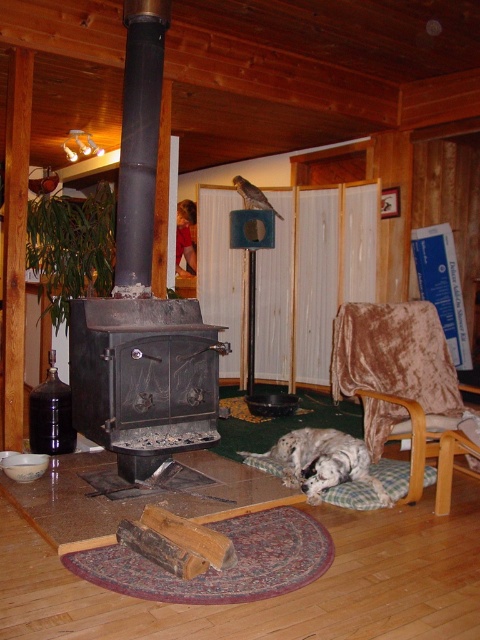
Is point (140, 248) farther from camera compared to point (393, 372)?

No, (140, 248) is in front of (393, 372).

Can you confirm if black matte fireplace at left is bigger than velvet brown rocking chair at lower right?

Yes, black matte fireplace at left is bigger than velvet brown rocking chair at lower right.

Between point (122, 296) and point (407, 304), which one is positioned behind?

Positioned behind is point (407, 304).

I want to click on black matte fireplace at left, so click(x=142, y=300).

Who is taller, velvet brown rocking chair at lower right or white fluffy dog at lower center?

Standing taller between the two is velvet brown rocking chair at lower right.

Who is shorter, velvet brown rocking chair at lower right or white fluffy dog at lower center?

white fluffy dog at lower center

Is point (437, 413) positioned after point (350, 472)?

Yes, it is.

This screenshot has width=480, height=640. I want to click on velvet brown rocking chair at lower right, so click(396, 378).

Can you confirm if black matte fireplace at left is positioned below black cast iron fireplace at center?

No, black matte fireplace at left is not below black cast iron fireplace at center.

Locate an element on the screen. Image resolution: width=480 pixels, height=640 pixels. black matte fireplace at left is located at coordinates (142, 300).